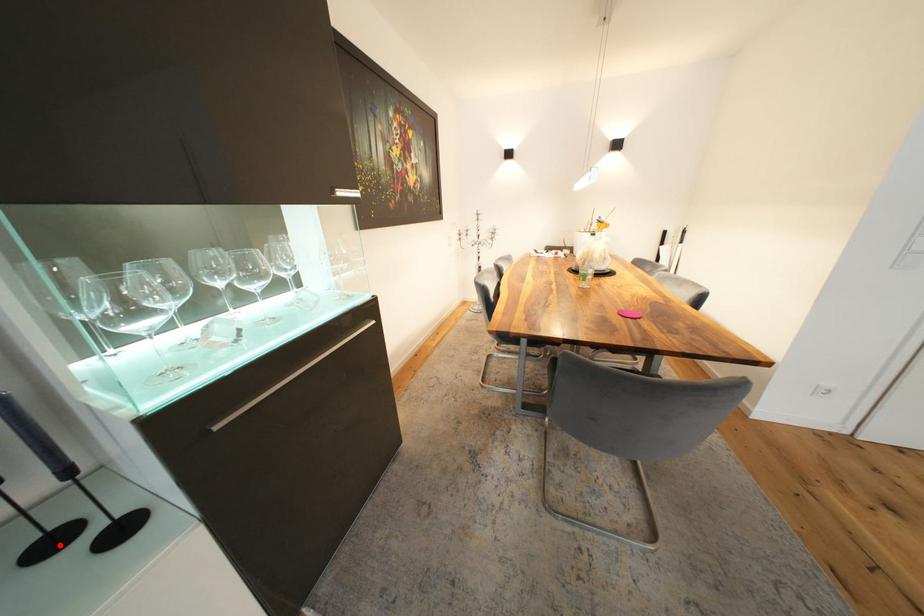
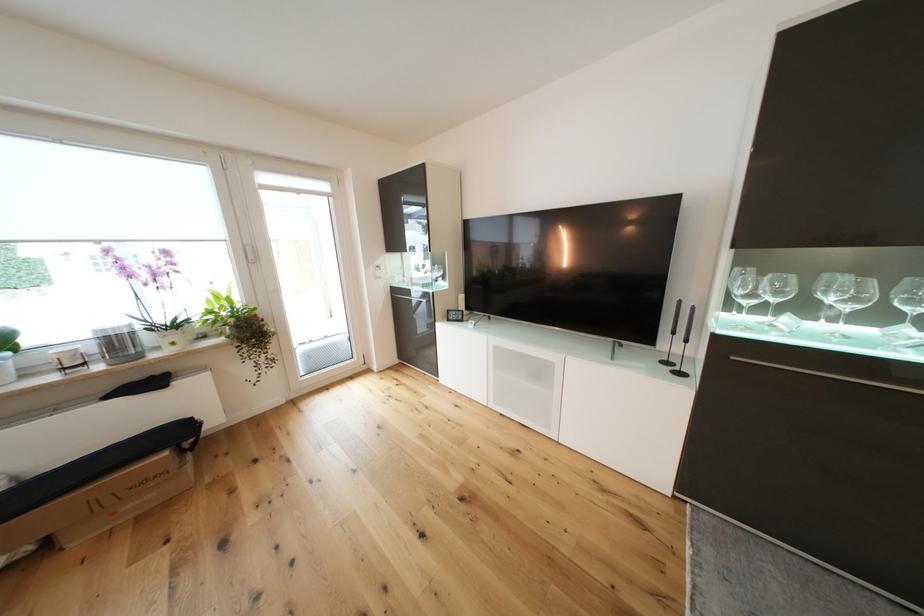
In the second image, find the point that corresponds to the highlighted location in the first image.

(674, 365)